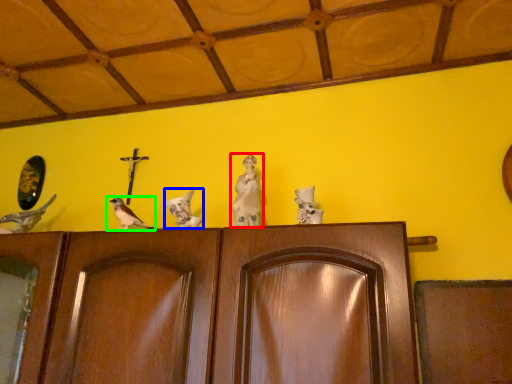
Question: Based on their relative distances, which object is nearer to sculpture (highlighted by a red box)? Choose from bird (highlighted by a blue box) and bird (highlighted by a green box).

Choices:
 (A) bird
 (B) bird

Answer: (A)